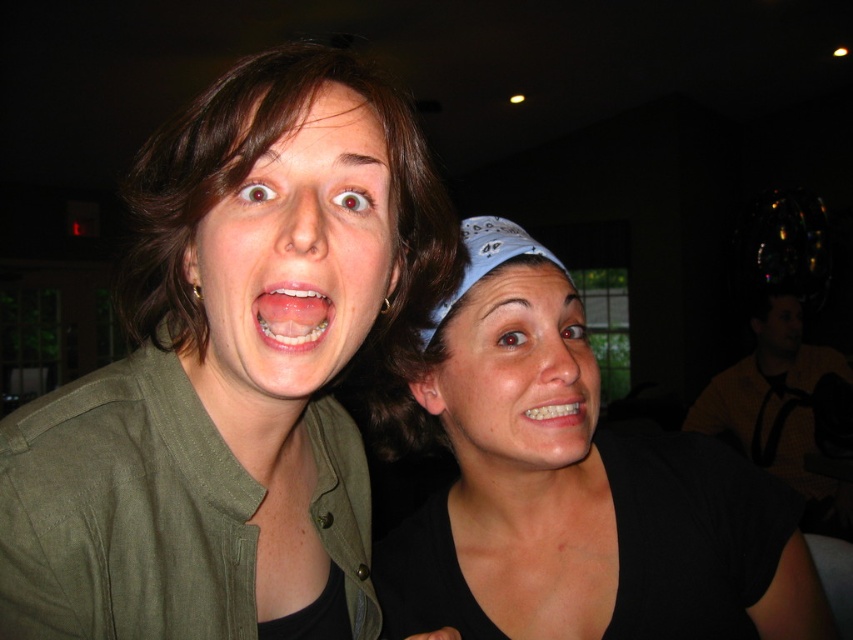
Question: Which object is farther from the camera taking this photo?

Choices:
 (A) matte white face at center
 (B) green matte jacket at upper left

Answer: (A)

Question: Can you confirm if green matte jacket at upper left is positioned below black matte bandana at center?

Choices:
 (A) yes
 (B) no

Answer: (B)

Question: Is green matte jacket at upper left below black matte bandana at center?

Choices:
 (A) yes
 (B) no

Answer: (B)

Question: Considering the real-world distances, which object is farthest from the matte white face at center?

Choices:
 (A) white glossy teeth at lower center
 (B) green matte jacket at upper left
 (C) matte green shirt at center
 (D) matte white teeth at center

Answer: (D)

Question: Estimate the real-world distances between objects in this image. Which object is farther from the black matte bandana at center?

Choices:
 (A) matte green shirt at center
 (B) white glossy teeth at lower center

Answer: (A)

Question: Does matte white face at center have a lesser width compared to matte white teeth at center?

Choices:
 (A) no
 (B) yes

Answer: (A)